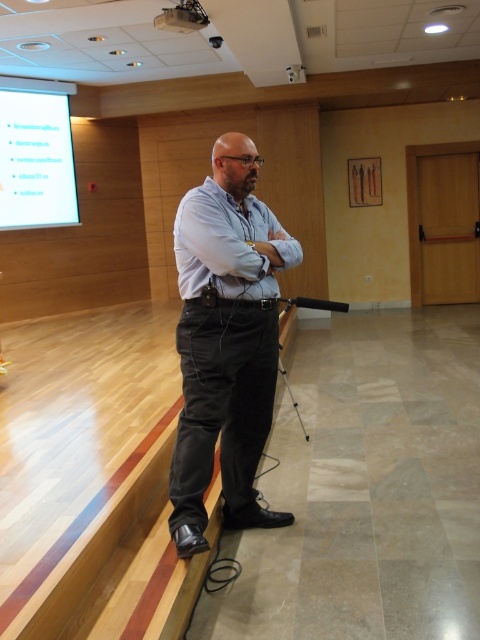
Does white glossy projection screen at upper left have a greater width compared to white plastic projector at upper center?

Yes, white glossy projection screen at upper left is wider than white plastic projector at upper center.

Who is more distant from viewer, (9, 80) or (180, 8)?

The point (9, 80) is more distant.

Find the location of `white glossy projection screen at upper left`. white glossy projection screen at upper left is located at coordinates (36, 154).

Is dark gray corduroy pants at center shorter than white plastic projector at upper center?

No.

This screenshot has width=480, height=640. In order to click on dark gray corduroy pants at center in this screenshot , I will do `click(226, 340)`.

Does dark gray corduroy pants at center appear on the right side of white glossy projection screen at upper left?

Indeed, dark gray corduroy pants at center is positioned on the right side of white glossy projection screen at upper left.

How much distance is there between dark gray corduroy pants at center and white glossy projection screen at upper left?

dark gray corduroy pants at center and white glossy projection screen at upper left are 5.27 meters apart.

This screenshot has width=480, height=640. Describe the element at coordinates (226, 340) in the screenshot. I see `dark gray corduroy pants at center` at that location.

Where is `dark gray corduroy pants at center`? The height and width of the screenshot is (640, 480). dark gray corduroy pants at center is located at coordinates (x=226, y=340).